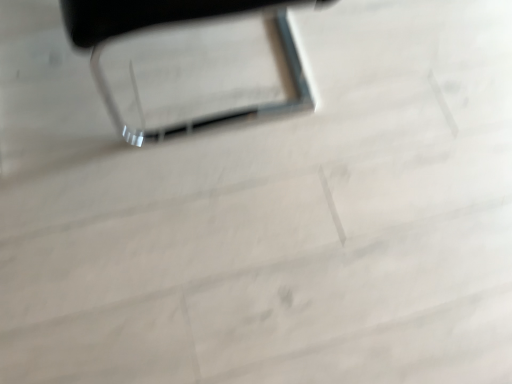
What do you see at coordinates (190, 62) in the screenshot? I see `clear acrylic stand at upper center` at bounding box center [190, 62].

Find the location of a particular element. This screenshot has width=512, height=384. clear acrylic stand at upper center is located at coordinates (190, 62).

You are a GUI agent. You are given a task and a screenshot of the screen. Output one action in this format:
    pyautogui.click(x=<x>, y=<y>)
    Task: Click on the clear acrylic stand at upper center
    This screenshot has width=512, height=384.
    Given the screenshot: What is the action you would take?
    pyautogui.click(x=190, y=62)